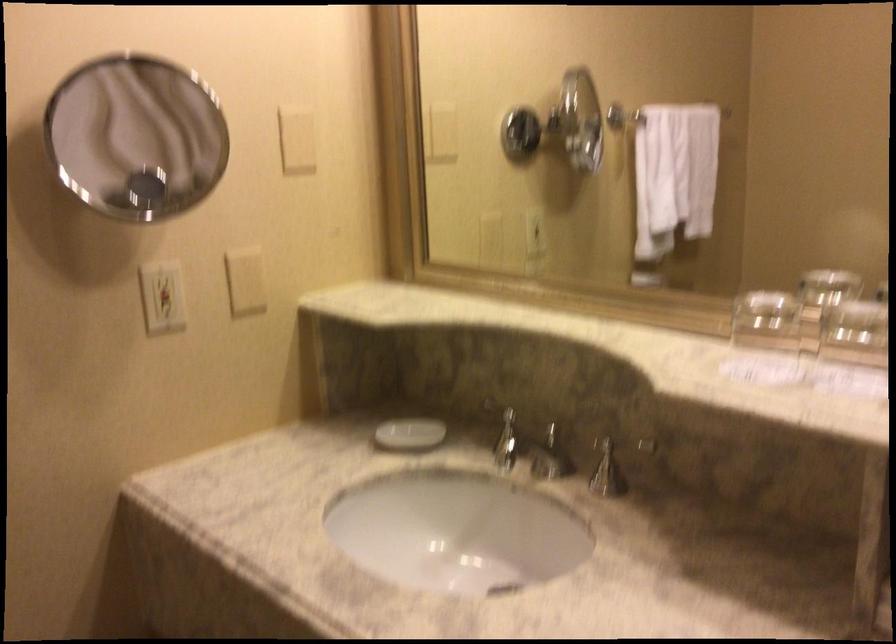
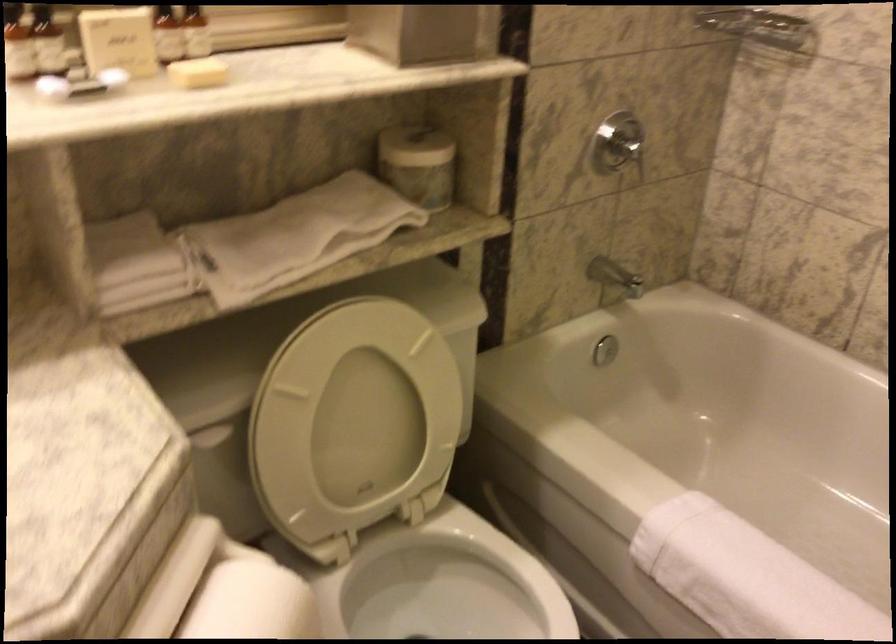
How did the camera likely rotate?

Answer: The camera's rotation is toward right-down.